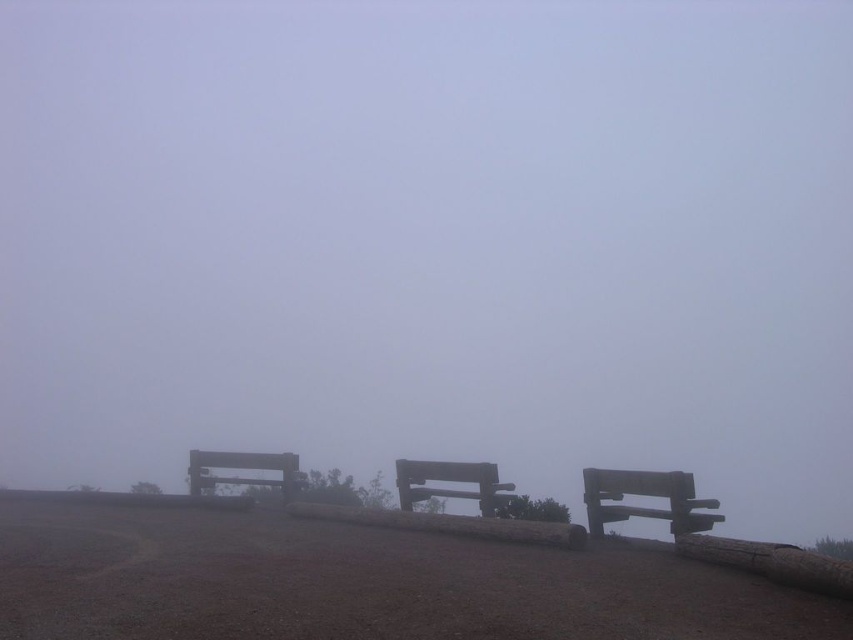
You are planning to sit on one of the benches in the foggy landscape. The smooth gray bench at center and the wooden bench at center are both available. Which bench offers more seating space due to its width?

The wooden bench at center has a greater width than the smooth gray bench at center, so it offers more seating space.

Looking at this image, you are standing in the foggy landscape and want to sit on the wooden bench at right and the smooth gray bench at center. Which bench should you approach first to reach the closer one?

The wooden bench at right is closer to the viewer than the smooth gray bench at center, so you should approach the wooden bench at right first.